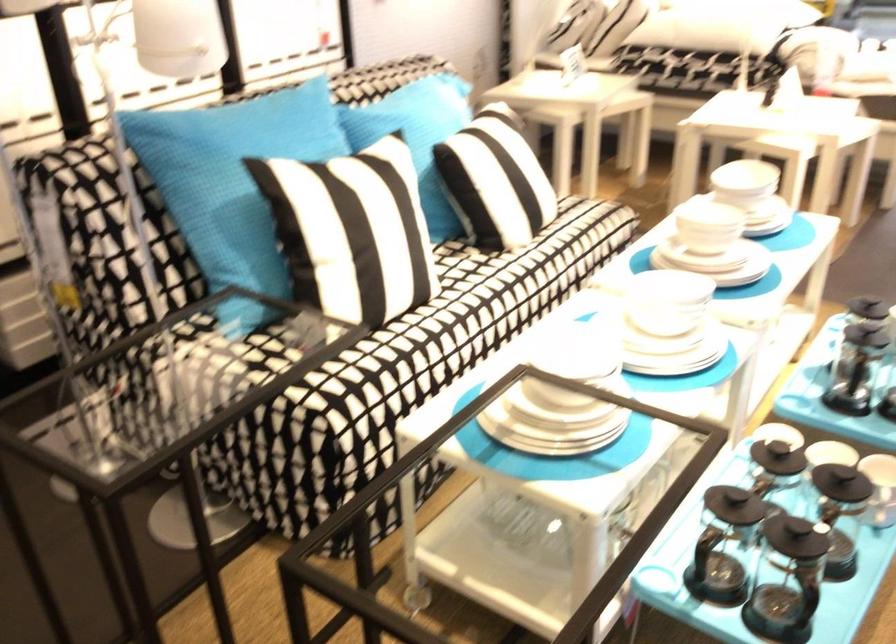
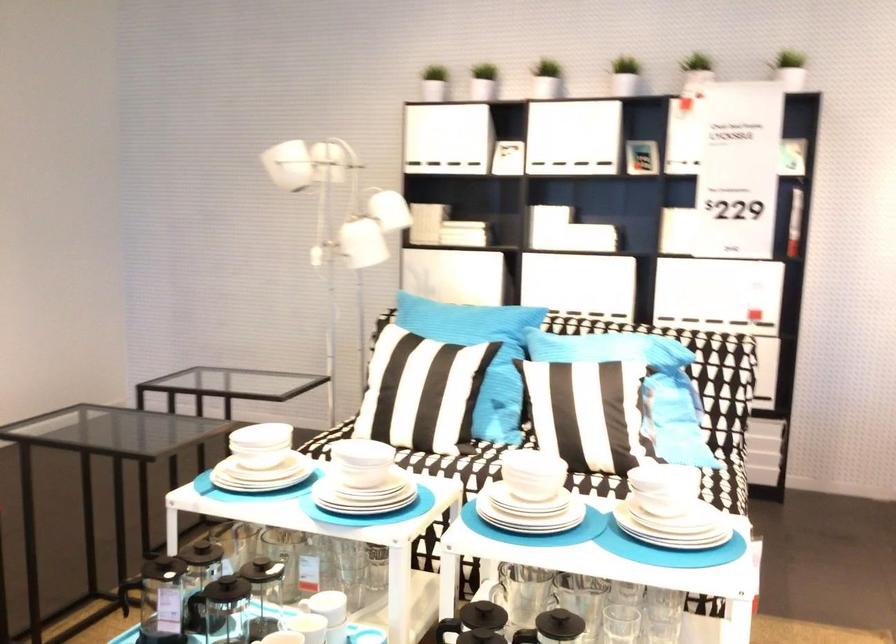
In the second image, find the point that corresponds to [767,451] in the first image.

(329, 605)